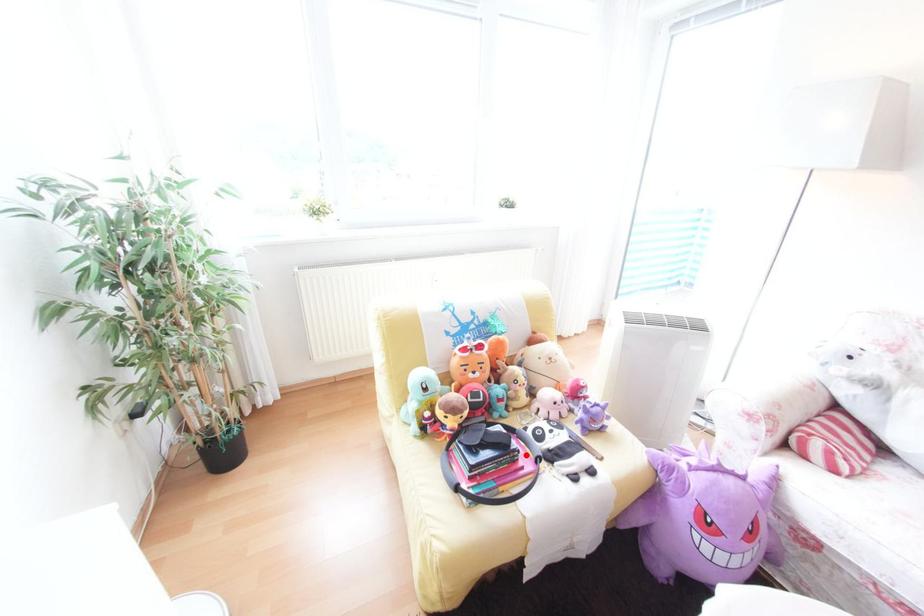
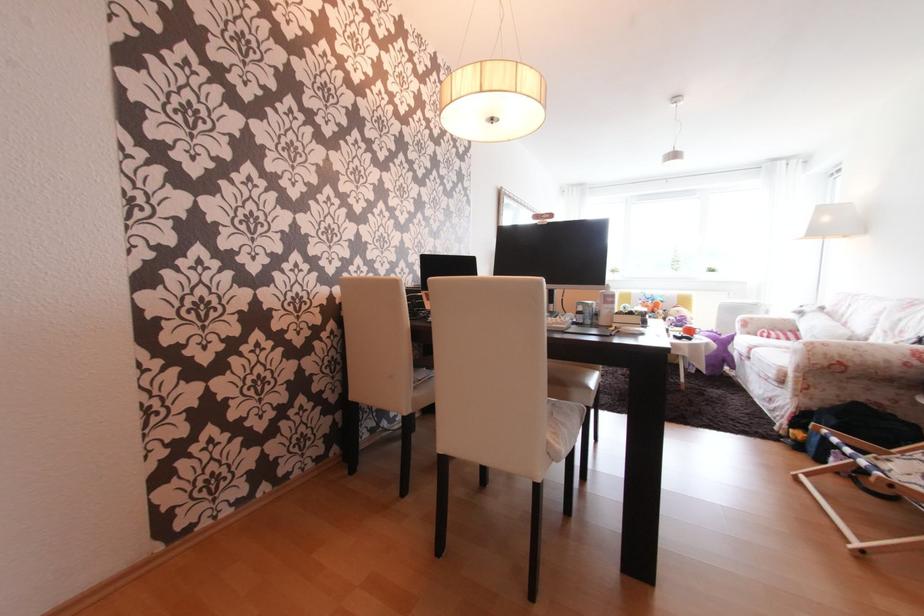
Question: I am providing you with two images of the same scene from different viewpoints. A red point is marked on the first image. At the location where the point appears in image 1, is it still visible in image 2?

Choices:
 (A) Yes
 (B) No

Answer: (B)